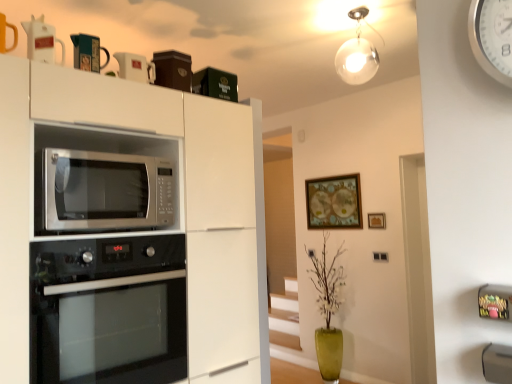
How much space does wooden framed map at upper center, the 2th picture frame positioned from the front, occupy vertically?

wooden framed map at upper center, the 2th picture frame positioned from the front, is 21.34 inches tall.

What do you see at coordinates (101, 192) in the screenshot? I see `satin silver microwave at center` at bounding box center [101, 192].

What is the approximate width of white glossy mug at upper center, which is the 1th appliance in back-to-front order?

white glossy mug at upper center, which is the 1th appliance in back-to-front order, is 3.94 inches wide.

I want to click on matte black mug at upper center, which appears as the 2th appliance when viewed from the back, so [88, 52].

Measure the distance between point (378, 219) and camera.

Point (378, 219) is 12.58 feet away from camera.

Image resolution: width=512 pixels, height=384 pixels. Describe the element at coordinates (124, 232) in the screenshot. I see `white matte cabinet at upper center` at that location.

You are a GUI agent. You are given a task and a screenshot of the screen. Output one action in this format:
    pyautogui.click(x=<x>, y=<y>)
    Task: Click on the black glass oven at lower left
    
    Given the screenshot: What is the action you would take?
    pyautogui.click(x=108, y=310)

Looking at this image, who is more distant, black glass oven at lower left or white plastic clock at upper right?

black glass oven at lower left is more distant.

In the scene shown: Is black glass oven at lower left aimed at white plastic clock at upper right?

Yes, black glass oven at lower left is facing white plastic clock at upper right.

Are black glass oven at lower left and white plastic clock at upper right far apart?

Absolutely, black glass oven at lower left is distant from white plastic clock at upper right.

Is white glossy pitcher at upper left, the first appliance when ordered from front to back, turned away from matte black mug at upper center, arranged as the 2th appliance when viewed from the front?

No, white glossy pitcher at upper left, the first appliance when ordered from front to back, is not facing away from matte black mug at upper center, arranged as the 2th appliance when viewed from the front.

You are a GUI agent. You are given a task and a screenshot of the screen. Output one action in this format:
    pyautogui.click(x=<x>, y=<y>)
    Task: Click on the appliance lying above the white glossy pitcher at upper left, the first appliance when ordered from front to back (from the image's perspective)
    Image resolution: width=512 pixels, height=384 pixels.
    Given the screenshot: What is the action you would take?
    pyautogui.click(x=88, y=52)

How different are the orientations of white glossy pitcher at upper left, which ranks as the 3th appliance in back-to-front order, and matte black mug at upper center, which appears as the 2th appliance when viewed from the back, in degrees?

white glossy pitcher at upper left, which ranks as the 3th appliance in back-to-front order, and matte black mug at upper center, which appears as the 2th appliance when viewed from the back, are facing 0.00213 degrees away from each other.

Is white glossy pitcher at upper left, the first appliance when ordered from front to back, taller or shorter than matte black mug at upper center, arranged as the 2th appliance when viewed from the front?

Considering their sizes, white glossy pitcher at upper left, the first appliance when ordered from front to back, has less height than matte black mug at upper center, arranged as the 2th appliance when viewed from the front.

Which object is positioned more to the right, white glossy mug at upper center, which is counted as the third appliance, starting from the front, or wooden picture frame at upper center, which is the second picture frame in back-to-front order?

wooden picture frame at upper center, which is the second picture frame in back-to-front order.

From a real-world perspective, is white glossy mug at upper center, which is the 1th appliance in back-to-front order, beneath wooden picture frame at upper center, which appears as the second picture frame when viewed from the left?

No, from a real-world perspective, white glossy mug at upper center, which is the 1th appliance in back-to-front order, is not under wooden picture frame at upper center, which appears as the second picture frame when viewed from the left.

In the scene shown: From the image's perspective, is white glossy mug at upper center, which is counted as the third appliance, starting from the front, positioned above or below wooden picture frame at upper center, arranged as the 1th picture frame when viewed from the right?

Clearly, from the image's perspective, white glossy mug at upper center, which is counted as the third appliance, starting from the front, is above wooden picture frame at upper center, arranged as the 1th picture frame when viewed from the right.

Which of these two, white glossy mug at upper center, which is the 1th appliance in back-to-front order, or wooden picture frame at upper center, which is the second picture frame in back-to-front order, is bigger?

Bigger between the two is white glossy mug at upper center, which is the 1th appliance in back-to-front order.

Which object is more forward, wooden picture frame at upper center, arranged as the 1th picture frame when viewed from the right, or satin silver microwave at center?

satin silver microwave at center is more forward.

How far apart are wooden picture frame at upper center, which appears as the second picture frame when viewed from the left, and satin silver microwave at center?

wooden picture frame at upper center, which appears as the second picture frame when viewed from the left, is 9.03 feet away from satin silver microwave at center.

Who is shorter, wooden picture frame at upper center, arranged as the 1th picture frame when viewed from the right, or satin silver microwave at center?

wooden picture frame at upper center, arranged as the 1th picture frame when viewed from the right, is shorter.

Between wooden picture frame at upper center, which is the second picture frame in back-to-front order, and satin silver microwave at center, which one has smaller width?

With smaller width is wooden picture frame at upper center, which is the second picture frame in back-to-front order.

Are white glossy mug at upper center, which is the 1th appliance in back-to-front order, and white plastic clock at upper right far apart?

Absolutely, white glossy mug at upper center, which is the 1th appliance in back-to-front order, is distant from white plastic clock at upper right.

How many degrees apart are the facing directions of white glossy mug at upper center, which is the 1th appliance in back-to-front order, and white plastic clock at upper right?

The angular difference between white glossy mug at upper center, which is the 1th appliance in back-to-front order, and white plastic clock at upper right is 83.8 degrees.

Would you say white glossy mug at upper center, which is counted as the third appliance, starting from the front, is inside or outside white plastic clock at upper right?

white glossy mug at upper center, which is counted as the third appliance, starting from the front, is not enclosed by white plastic clock at upper right.

Is white glossy mug at upper center, which is the 1th appliance in back-to-front order, to the left of white plastic clock at upper right from the viewer's perspective?

Yes, white glossy mug at upper center, which is the 1th appliance in back-to-front order, is to the left of white plastic clock at upper right.

Is white matte cabinet at upper center not inside white plastic clock at upper right?

white matte cabinet at upper center is positioned outside white plastic clock at upper right.

Visually, is white matte cabinet at upper center positioned to the left or to the right of white plastic clock at upper right?

white matte cabinet at upper center is to the left of white plastic clock at upper right.

How much distance is there between white matte cabinet at upper center and white plastic clock at upper right?

The distance of white matte cabinet at upper center from white plastic clock at upper right is 4.34 feet.

Who is shorter, white matte cabinet at upper center or white plastic clock at upper right?

white plastic clock at upper right.

Based on the photo, considering the relative sizes of white matte cabinet at upper center and wooden picture frame at upper center, which is the second picture frame in back-to-front order, in the image provided, is white matte cabinet at upper center shorter than wooden picture frame at upper center, which is the second picture frame in back-to-front order,?

In fact, white matte cabinet at upper center may be taller than wooden picture frame at upper center, which is the second picture frame in back-to-front order.

Does point (173, 289) lie in front of point (370, 221)?

Yes, it is in front of point (370, 221).

Is white matte cabinet at upper center aimed at wooden picture frame at upper center, the 1th picture frame viewed from the front?

No, white matte cabinet at upper center does not turn towards wooden picture frame at upper center, the 1th picture frame viewed from the front.

Choose the correct answer: Is white matte cabinet at upper center inside wooden picture frame at upper center, the 1th picture frame viewed from the front, or outside it?

white matte cabinet at upper center is spatially situated outside wooden picture frame at upper center, the 1th picture frame viewed from the front.

The height and width of the screenshot is (384, 512). In order to click on oven to the left of white plastic clock at upper right in this screenshot , I will do `click(108, 310)`.

This screenshot has height=384, width=512. I want to click on appliance located above the white glossy pitcher at upper left, which ranks as the 3th appliance in back-to-front order (from the image's perspective), so click(x=88, y=52).

Based on their spatial positions, is white plastic clock at upper right or white matte cabinet at upper center further from black glass oven at lower left?

The object further to black glass oven at lower left is white plastic clock at upper right.

Estimate the real-world distances between objects in this image. Which object is further from white glossy pitcher at upper left, the first appliance when ordered from front to back, wooden picture frame at upper center, the 1th picture frame viewed from the front, or black glass oven at lower left?

wooden picture frame at upper center, the 1th picture frame viewed from the front, is further to white glossy pitcher at upper left, the first appliance when ordered from front to back.

Considering their positions, is wooden framed map at upper center, the 2th picture frame positioned from the front, positioned closer to white matte cabinet at upper center than satin silver microwave at center?

satin silver microwave at center.

Estimate the real-world distances between objects in this image. Which object is further from white matte cabinet at upper center, white glossy mug at upper center, which is the 1th appliance in back-to-front order, or matte black mug at upper center, which appears as the 2th appliance when viewed from the back?

Among the two, matte black mug at upper center, which appears as the 2th appliance when viewed from the back, is located further to white matte cabinet at upper center.

When comparing their distances from wooden picture frame at upper center, which appears as the second picture frame when viewed from the left, does white glossy mug at upper center, which is the 1th appliance in back-to-front order, or wooden framed map at upper center, which is the first picture frame from left to right, seem closer?

Among the two, wooden framed map at upper center, which is the first picture frame from left to right, is located nearer to wooden picture frame at upper center, which appears as the second picture frame when viewed from the left.

From the image, which object appears to be farther from satin silver microwave at center, matte black mug at upper center, which appears as the 2th appliance when viewed from the back, or white plastic clock at upper right?

The object further to satin silver microwave at center is white plastic clock at upper right.

Looking at the image, which one is located closer to wooden framed map at upper center, which is the first picture frame from left to right, wooden picture frame at upper center, the 1th picture frame viewed from the front, or black glass oven at lower left?

wooden picture frame at upper center, the 1th picture frame viewed from the front, is positioned closer to the anchor wooden framed map at upper center, which is the first picture frame from left to right.

Based on their spatial positions, is black glass oven at lower left or wooden framed map at upper center, placed as the 1th picture frame when sorted from back to front, closer to matte black mug at upper center, arranged as the 2th appliance when viewed from the front?

Based on the image, black glass oven at lower left appears to be nearer to matte black mug at upper center, arranged as the 2th appliance when viewed from the front.

This screenshot has width=512, height=384. Identify the location of appliance between white glossy pitcher at upper left, the first appliance when ordered from front to back, and satin silver microwave at center, in the vertical direction. (135, 67).

Find the location of `microwave oven between matte black mug at upper center, arranged as the 2th appliance when viewed from the front, and black glass oven at lower left vertically`. microwave oven between matte black mug at upper center, arranged as the 2th appliance when viewed from the front, and black glass oven at lower left vertically is located at coordinates (101, 192).

Locate an element on the screen. This screenshot has width=512, height=384. cabinetry situated between white glossy pitcher at upper left, which ranks as the 3th appliance in back-to-front order, and white plastic clock at upper right from left to right is located at coordinates tap(124, 232).

Locate an element on the screen. The image size is (512, 384). cabinetry between white glossy pitcher at upper left, which ranks as the 3th appliance in back-to-front order, and black glass oven at lower left, in the vertical direction is located at coordinates (124, 232).